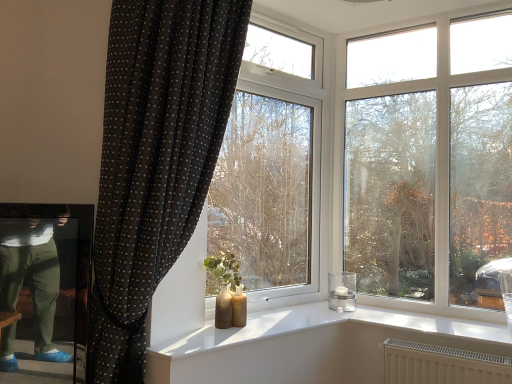
Where is `vacant area that is in front of clear glass candle holder at window`? vacant area that is in front of clear glass candle holder at window is located at coordinates (339, 318).